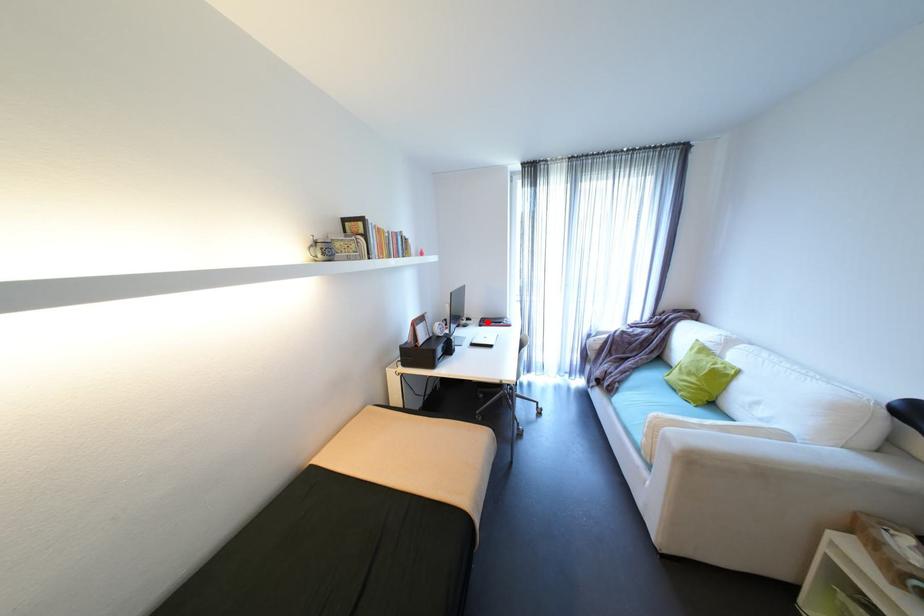
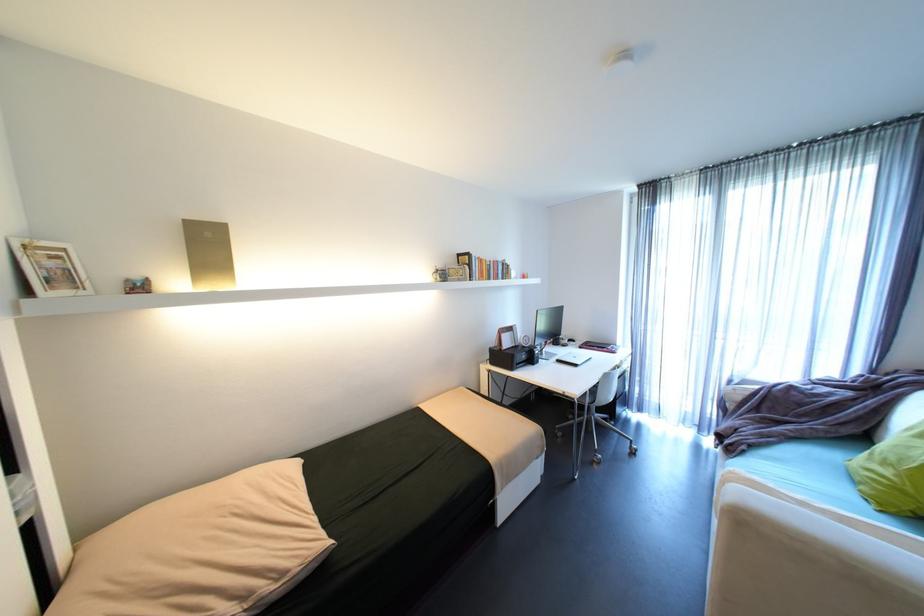
Where in the second image is the point corresponding to the highlighted location from the first image?

(589, 344)